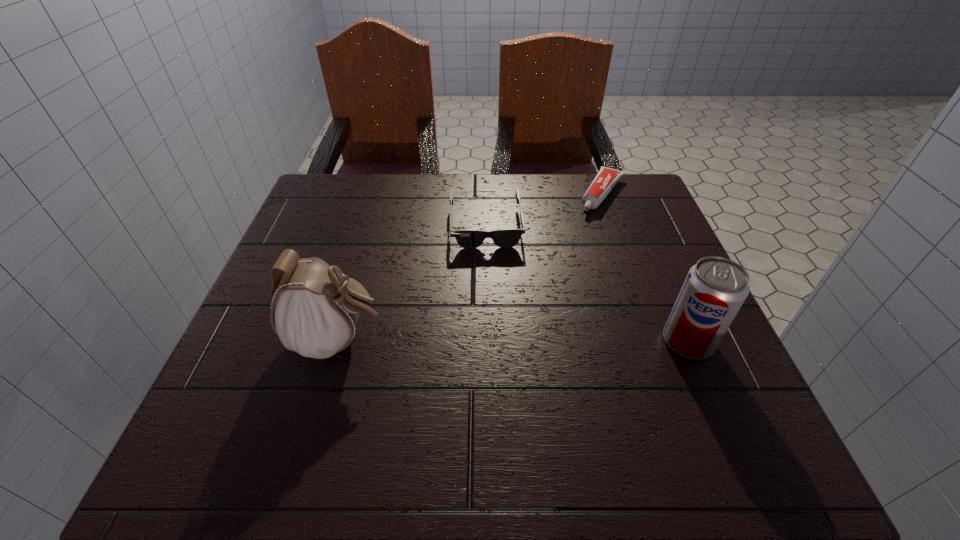
Identify the location of free space located at the nozzle of the shortest object. This screenshot has width=960, height=540. (585, 230).

The width and height of the screenshot is (960, 540). Identify the location of vacant space located 0.360m at the nozzle of the shortest object. (537, 302).

You are a GUI agent. You are given a task and a screenshot of the screen. Output one action in this format:
    pyautogui.click(x=<x>, y=<y>)
    Task: Click on the free space located 0.060m at the nozzle of the shortest object
    The height and width of the screenshot is (540, 960).
    Given the screenshot: What is the action you would take?
    pyautogui.click(x=588, y=226)

The height and width of the screenshot is (540, 960). Identify the location of sunglasses at the far edge. (467, 238).

The width and height of the screenshot is (960, 540). I want to click on toothpaste located in the far edge section of the desktop, so [606, 179].

Identify the location of object positioned at the near edge. The height and width of the screenshot is (540, 960). (314, 312).

I want to click on object that is at the left edge, so [x=314, y=312].

I want to click on soda present at the right edge, so click(x=715, y=288).

What are the coordinates of `toothpaste present at the right edge` in the screenshot? It's located at (606, 179).

In order to click on object present at the near left corner in this screenshot , I will do `click(314, 312)`.